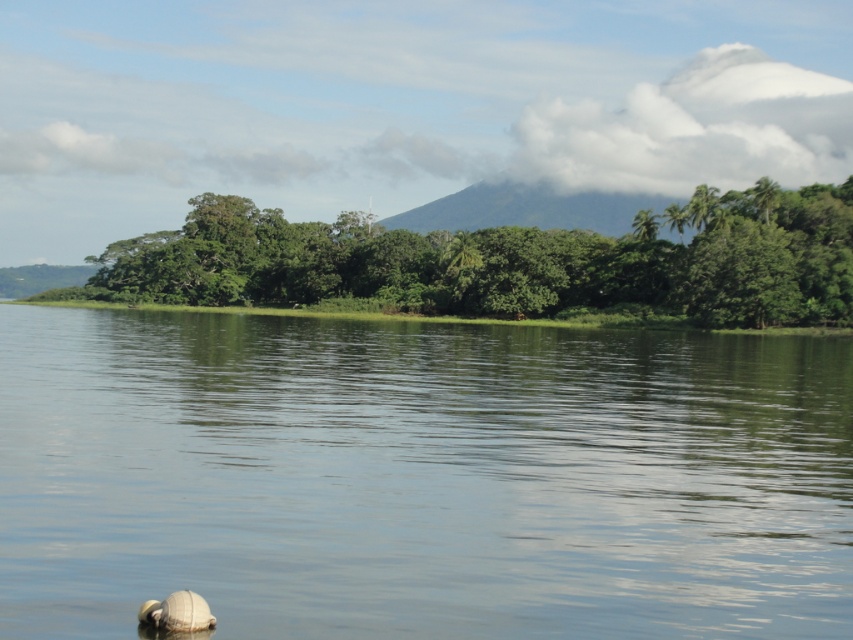
Question: Which of the following is the farthest from the observer?

Choices:
 (A) (695, 236)
 (B) (680, 356)

Answer: (A)

Question: Which point is closer to the camera?

Choices:
 (A) green smooth water at center
 (B) green leafy trees at center

Answer: (A)

Question: Can you confirm if green smooth water at center is smaller than green leafy trees at center?

Choices:
 (A) yes
 (B) no

Answer: (A)

Question: Does green smooth water at center appear on the right side of green leafy trees at center?

Choices:
 (A) no
 (B) yes

Answer: (B)

Question: Is green smooth water at center wider than green leafy trees at center?

Choices:
 (A) no
 (B) yes

Answer: (A)